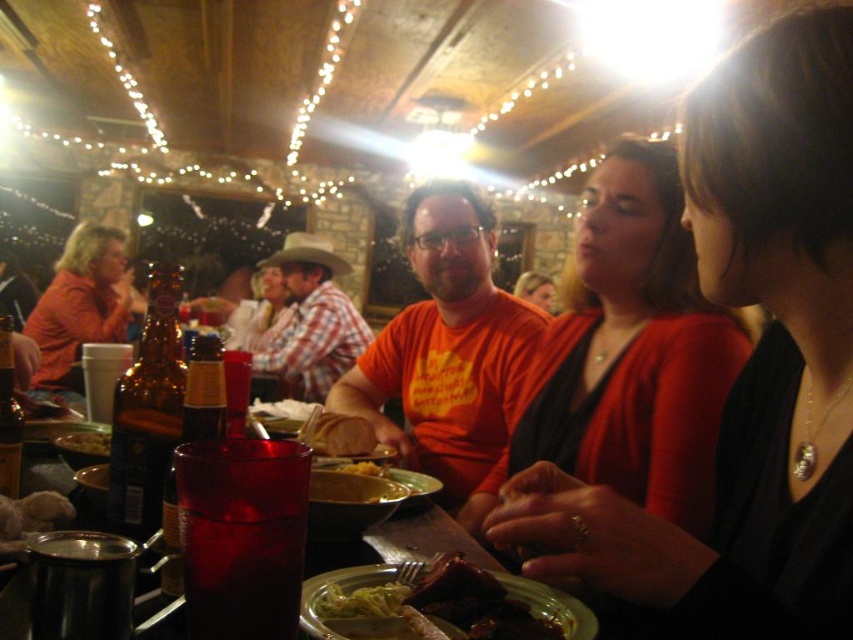
You are a waiter at the restaurant and need to deliver a drink to the customer wearing the matte black shirt at center. There is a translucent glass at center on the table. Which object should you move first to make space?

The translucent glass at center should be moved first because the matte black shirt at center is closer to the viewer, indicating that the shirt is in front of the glass. Therefore, moving the glass would create space without obstructing the shirt.

You are a photographer trying to capture a closeup of the yellow mashed potato at center. You notice the matte orange shirt at left is blocking part of your view. Which object should you move to get a clear shot?

You should move the matte orange shirt at left because it is larger and blocking the view of the yellow mashed potato at center.

You are a waiter in the restaurant. You see a customer wearing the matte orange shirt at left and another customer with the yellow mashed potato at center on their plate. Which customer is sitting closer to the ceiling?

The matte orange shirt at left is above the yellow mashed potato at center, so the customer wearing the matte orange shirt at left is sitting closer to the ceiling.